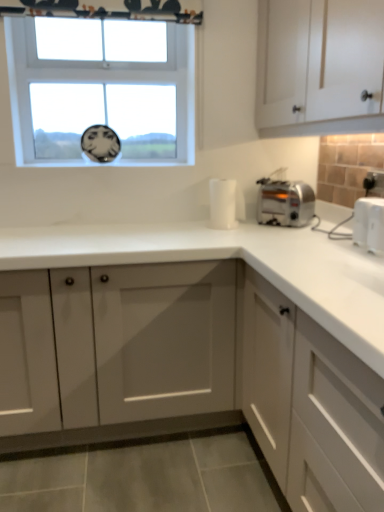
The image size is (384, 512). Find the location of `vacant area that is in front of satin silver toaster at right`. vacant area that is in front of satin silver toaster at right is located at coordinates (289, 231).